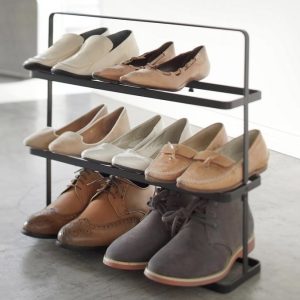
This screenshot has width=300, height=300. Find the location of `metal rods of shelf`. metal rods of shelf is located at coordinates (218, 288), (219, 197), (204, 102), (181, 23).